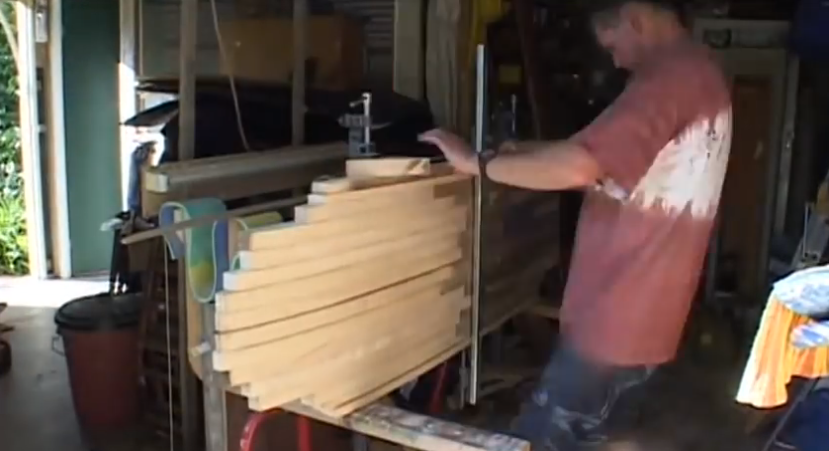
Identify the location of yellow cloth. This screenshot has width=829, height=451. (760, 360).